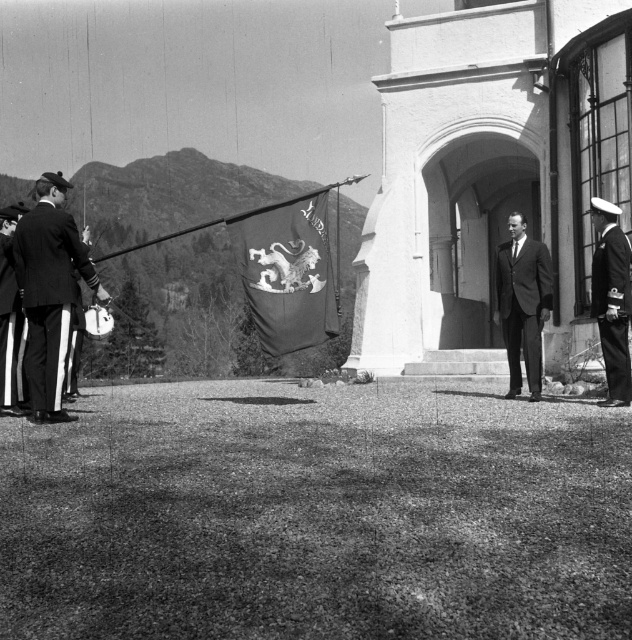
You are attending a formal outdoor event and notice two individuals in the scene. One is wearing a dark gray suit at center and the other is in a shiny black uniform at right. Based on their positions, which individual is closer to the left side of the scene?

The dark gray suit at center is closer to the left side of the scene because it is positioned to the left of the shiny black uniform at right.

In the image of the formal outdoor event, there is a point labeled at coordinates (49, 291). What is the subject located at this point?

The point at coordinates (49, 291) indicates a uniformed man at left.